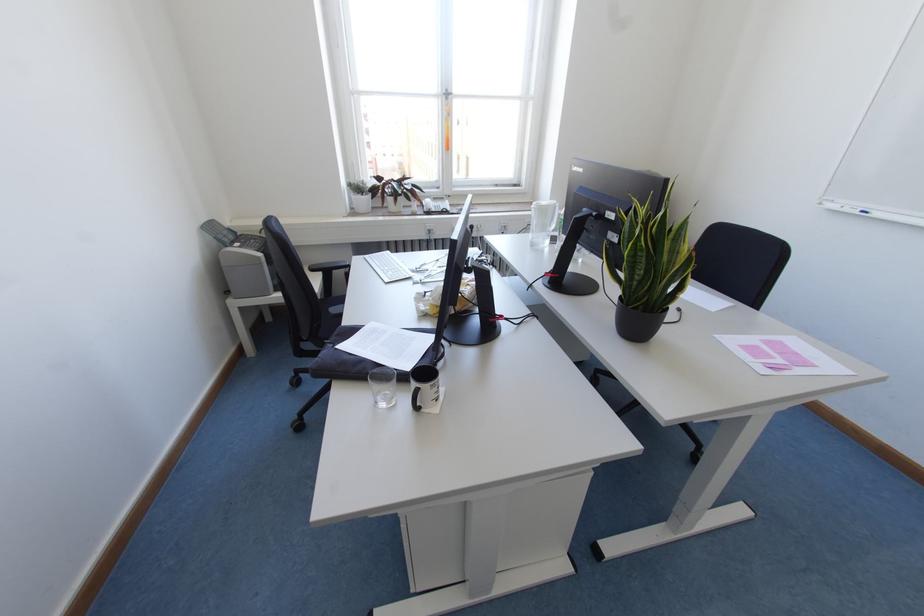
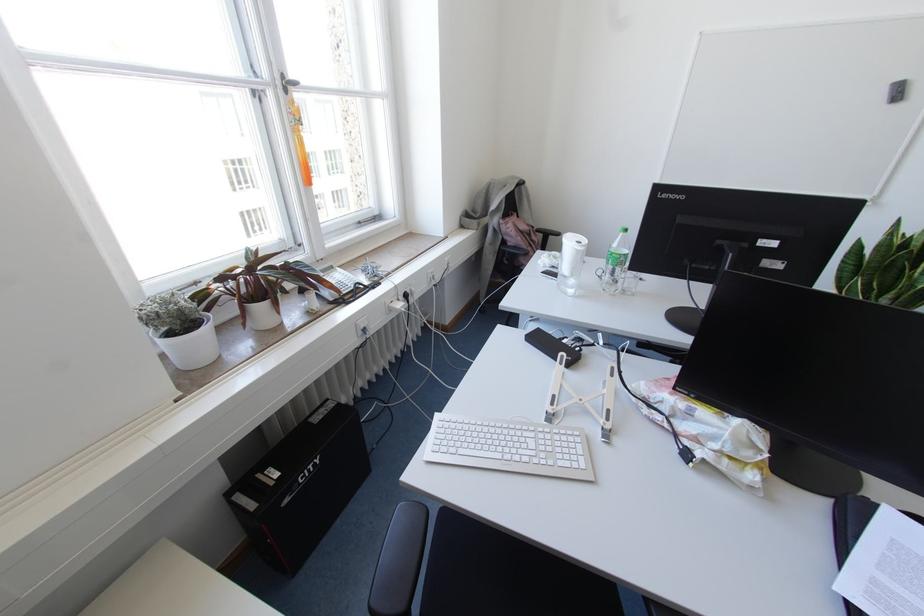
Where in the second image is the point corresponding to [445,200] from the first image?

(336, 268)